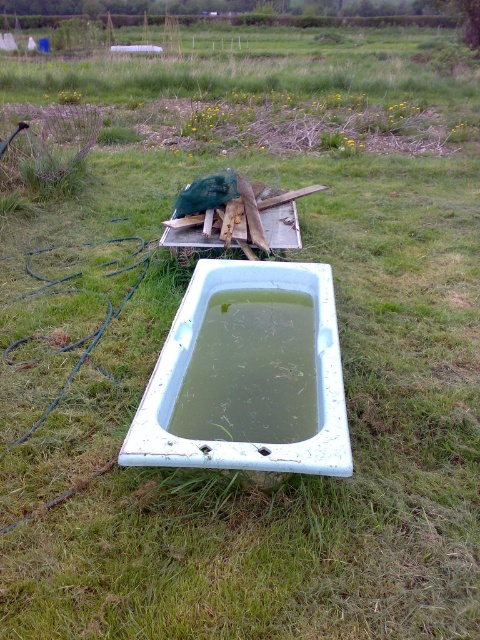
Question: Is white porcelain tub at center above green murky water at center?

Choices:
 (A) yes
 (B) no

Answer: (A)

Question: Can you confirm if white porcelain tub at center is thinner than green murky water at center?

Choices:
 (A) no
 (B) yes

Answer: (A)

Question: Does white porcelain tub at center appear under green murky water at center?

Choices:
 (A) yes
 (B) no

Answer: (B)

Question: Which of the following is the closest to the observer?

Choices:
 (A) white porcelain tub at center
 (B) green murky water at center

Answer: (A)